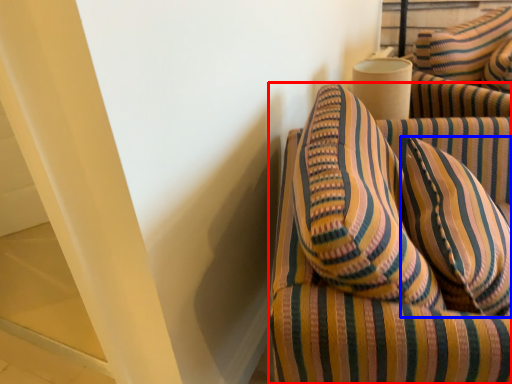
Question: Which object is further to the camera taking this photo, furniture (highlighted by a red box) or pillow (highlighted by a blue box)?

Choices:
 (A) furniture
 (B) pillow

Answer: (B)